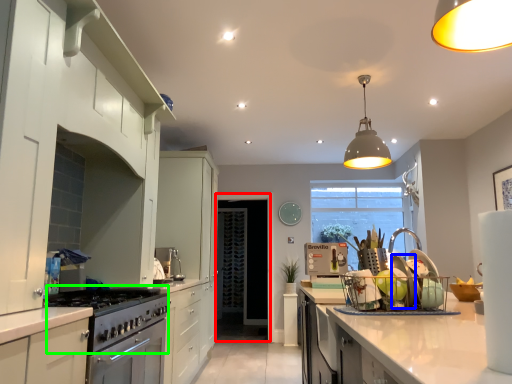
Question: Which object is positioned farthest from glass door (highlighted by a red box)? Select from appliance (highlighted by a blue box) and gas stove (highlighted by a green box).

Choices:
 (A) appliance
 (B) gas stove

Answer: (A)